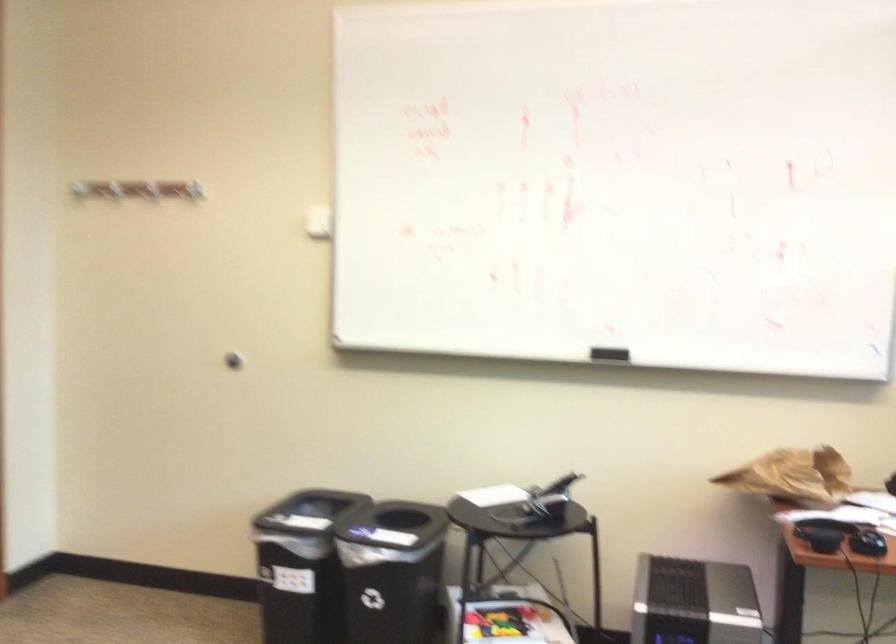
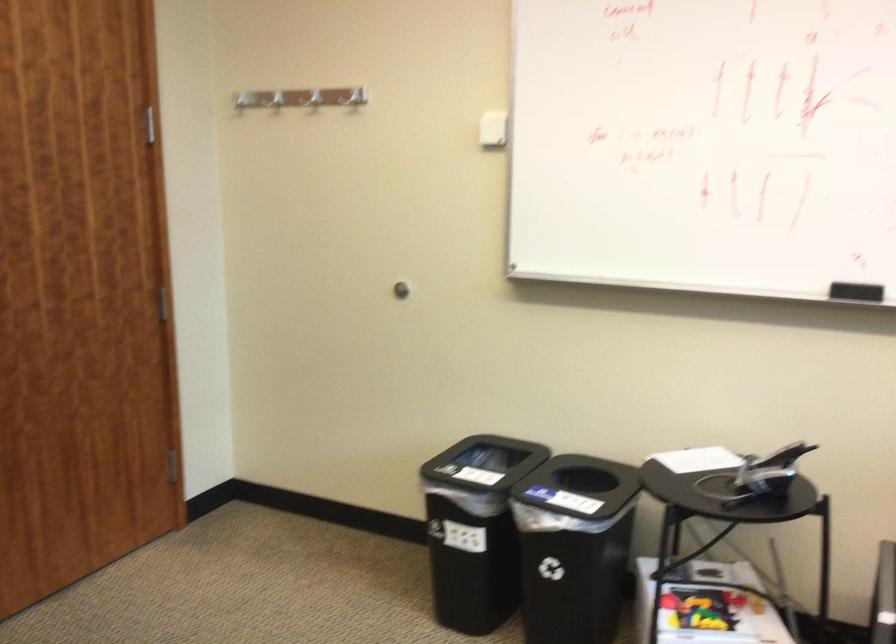
In the second image, find the point that corresponds to [613,357] in the first image.

(856, 292)